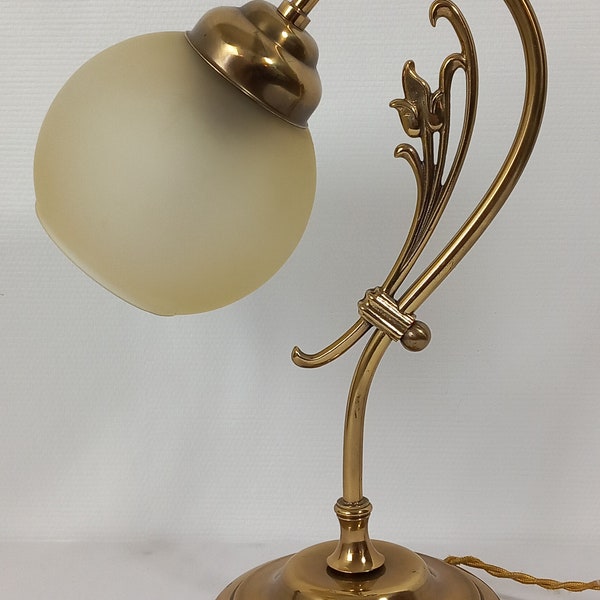
Locate an element on the screen. The image size is (600, 600). arm of lamp is located at coordinates (519, 146).